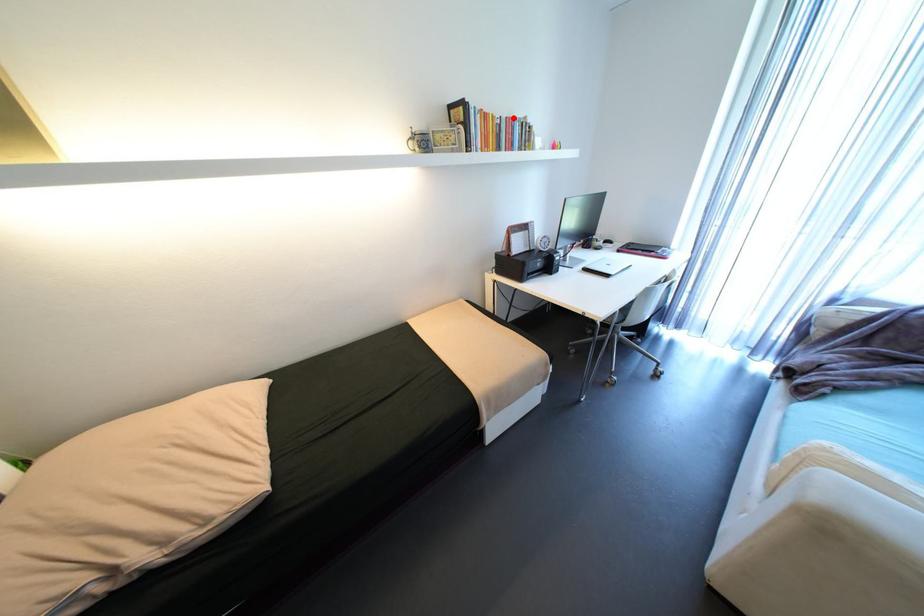
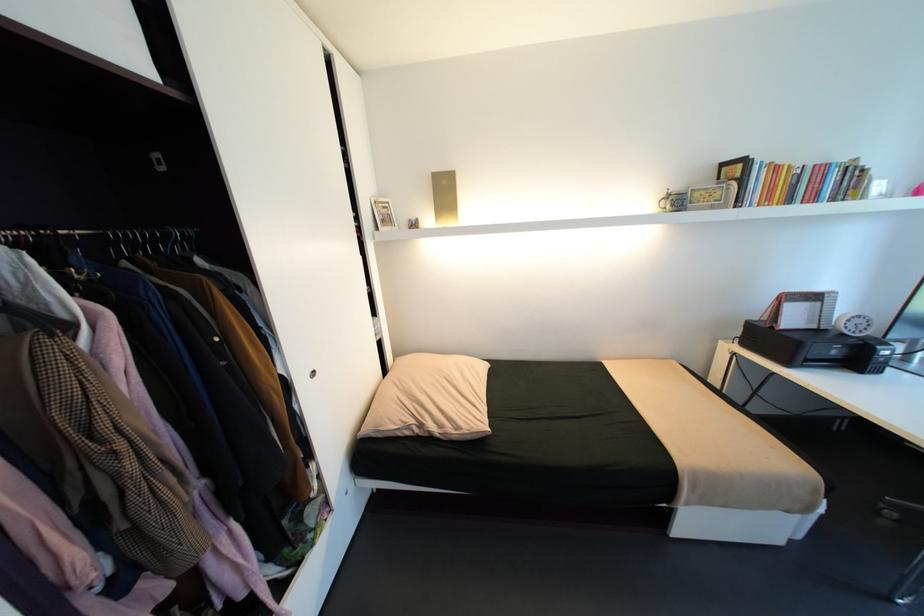
Question: I am providing you with two images of the same scene from different viewpoints. A red point is marked on the first image. At the location where the point appears in image 1, is it still visible in image 2?

Choices:
 (A) Yes
 (B) No

Answer: (A)